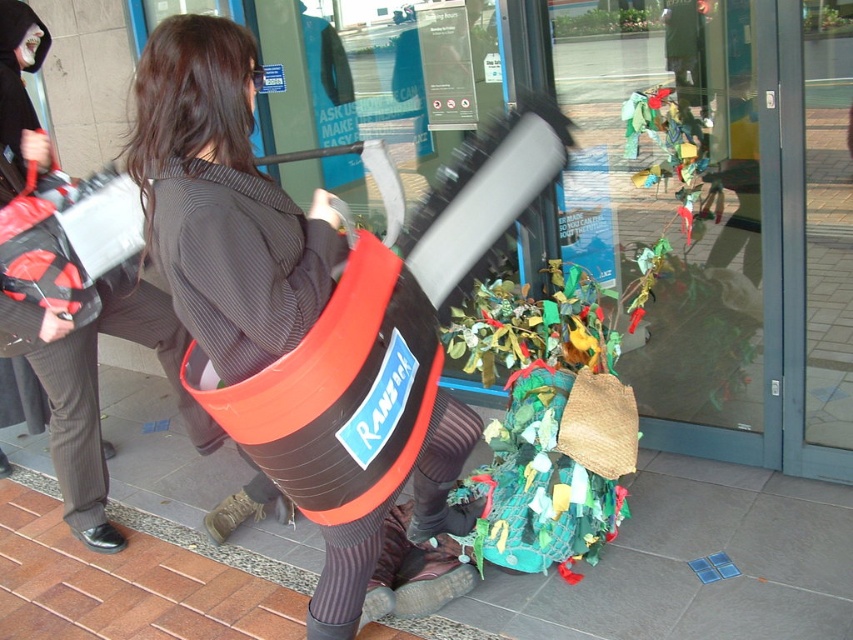
You are trying to exit through the transparent glass door at center but notice the matte black bag at center is blocking your path. Can you still exit through the door?

The matte black bag at center is behind transparent glass door at center, so it is not blocking the path to the door. You can still exit through the transparent glass door at center.